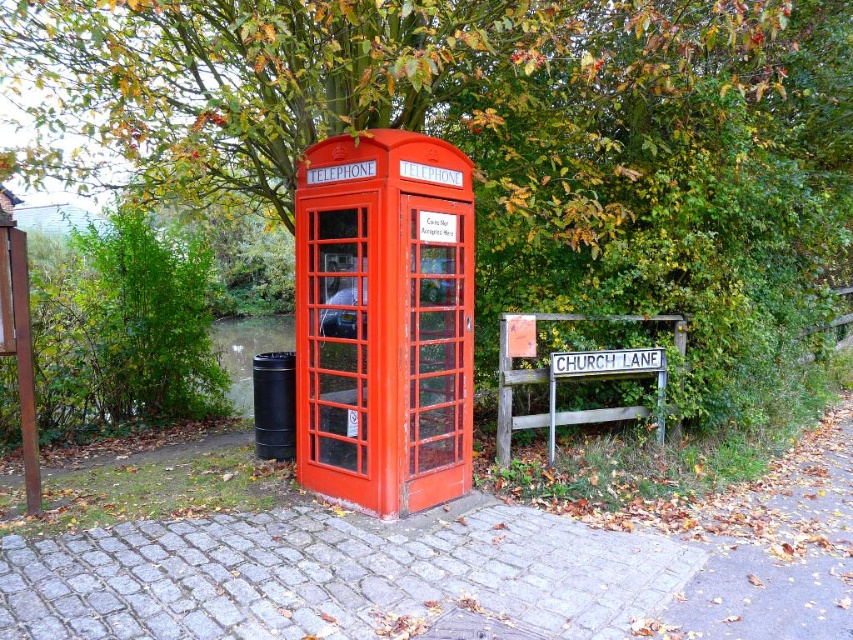
Who is more distant from viewer, (434, 22) or (309, 176)?

The point (434, 22) is behind.

Does green leafy tree at upper center have a lesser width compared to matte red telephone booth at center?

Correct, green leafy tree at upper center's width is less than matte red telephone booth at center's.

Who is more forward, (575, 269) or (337, 320)?

Positioned in front is point (337, 320).

This screenshot has height=640, width=853. I want to click on green leafy tree at upper center, so click(488, 129).